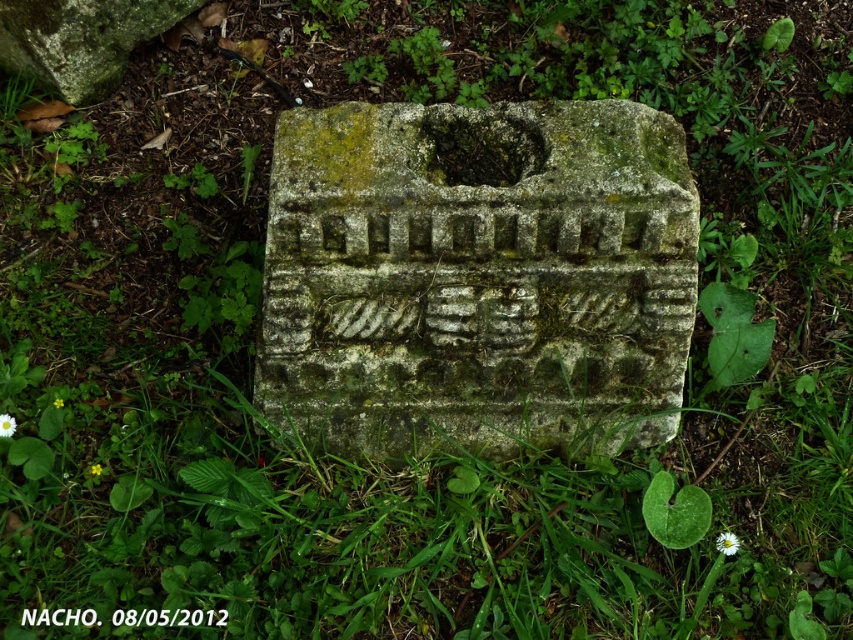
Which is behind, point (363, 244) or point (96, 625)?

Point (363, 244)

Is green mossy stone at center smaller than black paper at center?

Incorrect, green mossy stone at center is not smaller in size than black paper at center.

Between point (387, 289) and point (138, 624), which one is positioned behind?

Point (387, 289)

At what (x,y) coordinates should I click in order to perform the action: click on green mossy stone at center. Please return your answer as a coordinate pair (x, y). The image size is (853, 640). Looking at the image, I should click on pyautogui.click(x=477, y=276).